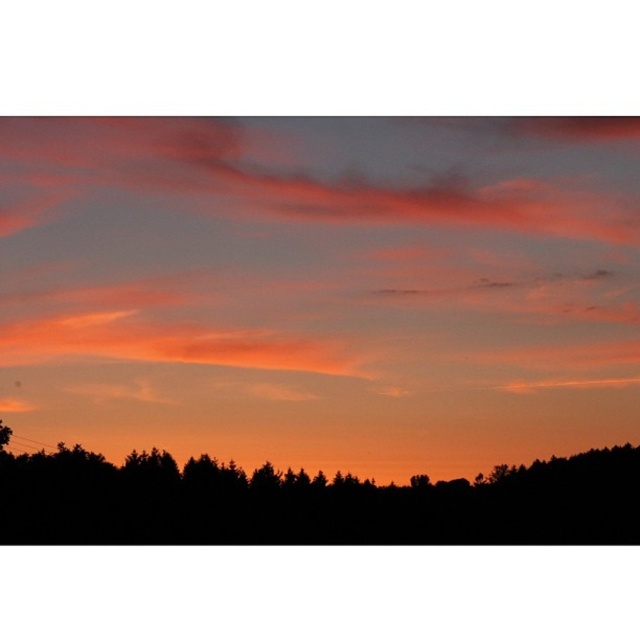
You are an astronomer observing the sunset and notice the matte orange cloud at upper center and the black silhouette tree at bottom. Which object is positioned higher in the sky? Please explain your reasoning based on the scene description.

The matte orange cloud at upper center is positioned higher in the sky than the black silhouette tree at bottom because it is described as being located above the tree in the scene.

You are an astronomer analyzing this sunset image. You need to determine the exact position of the matte orange cloud at upper center in the image. Where is it located?

The matte orange cloud at upper center is located at the 2D coordinates point (321, 288).